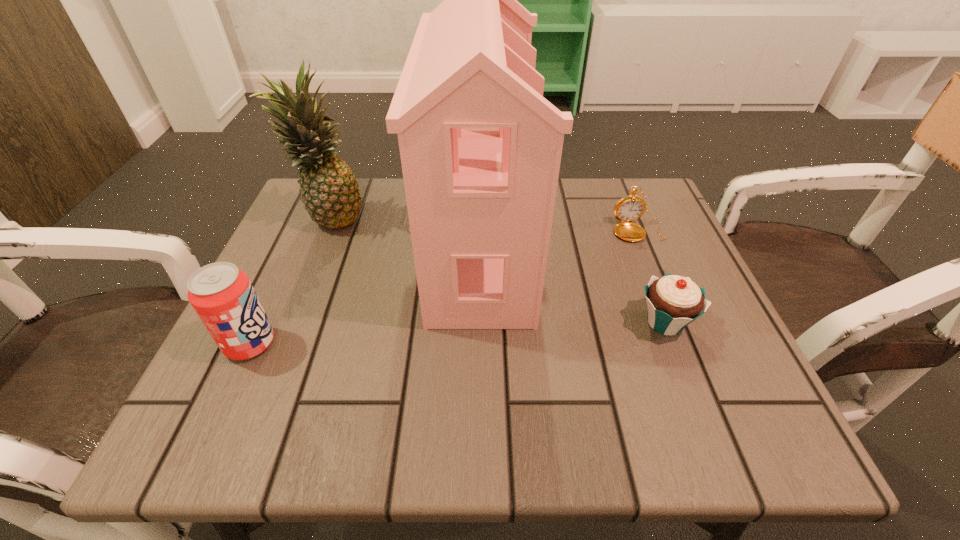
At what (x,y) coordinates should I click in order to perform the action: click on vacant area that lies between the pocket watch and the cupcake. Please return your answer as a coordinate pair (x, y). Looking at the image, I should click on (652, 276).

What are the coordinates of `vacant point located between the third object from right to left and the pocket watch` in the screenshot? It's located at (559, 238).

Identify which object is the third nearest to the pocket watch. Please provide its 2D coordinates. Your answer should be formatted as a tuple, i.e. [(x, y)], where the tuple contains the x and y coordinates of a point satisfying the conditions above.

[(329, 189)]

Locate an element on the screen. The width and height of the screenshot is (960, 540). object that is the closest to the second tallest object is located at coordinates pyautogui.click(x=480, y=147).

Locate an element on the screen. The image size is (960, 540). vacant position in the image that satisfies the following two spatial constraints: 1. on the face of the pocket watch; 2. on the front-facing side of the tallest object is located at coordinates (645, 245).

This screenshot has width=960, height=540. What are the coordinates of `vacant space that satisfies the following two spatial constraints: 1. on the front-facing side of the tallest object; 2. on the right side of the cupcake` in the screenshot? It's located at tap(480, 322).

Identify the location of vacant point that satisfies the following two spatial constraints: 1. on the front side of the pineapple; 2. on the surface of the third shortest object. This screenshot has height=540, width=960. (280, 343).

You are a GUI agent. You are given a task and a screenshot of the screen. Output one action in this format:
    pyautogui.click(x=<x>, y=<y>)
    Task: Click on the vacant space that satisfies the following two spatial constraints: 1. on the face of the pocket watch; 2. on the surface of the third shortest object
    This screenshot has height=540, width=960.
    Given the screenshot: What is the action you would take?
    pyautogui.click(x=685, y=343)

You are a GUI agent. You are given a task and a screenshot of the screen. Output one action in this format:
    pyautogui.click(x=<x>, y=<y>)
    Task: Click on the free space that satisfies the following two spatial constraints: 1. on the face of the pocket watch; 2. on the surface of the third tallest object
    This screenshot has height=540, width=960.
    Given the screenshot: What is the action you would take?
    pyautogui.click(x=685, y=343)

Identify the location of free location that satisfies the following two spatial constraints: 1. on the front side of the pineapple; 2. on the surface of the soda can. (280, 343).